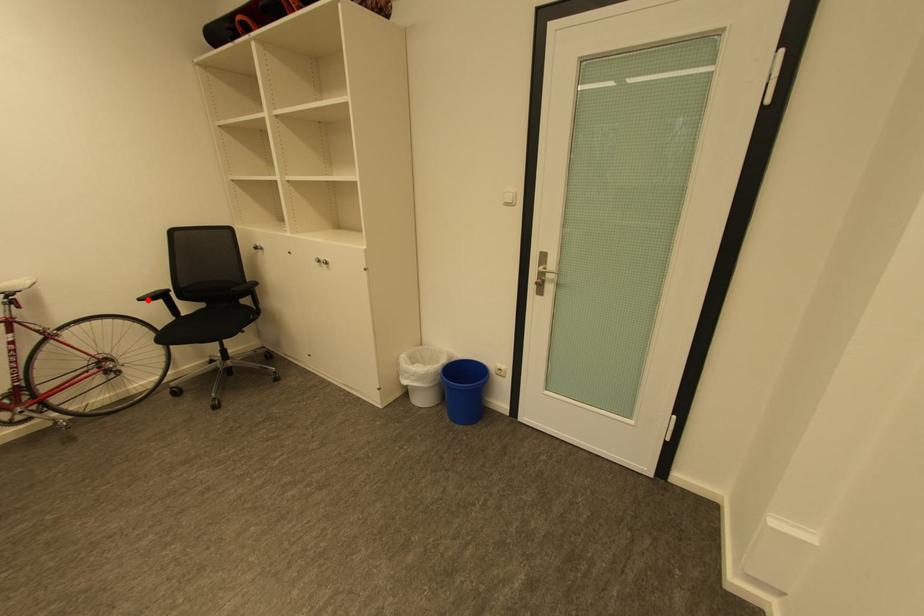
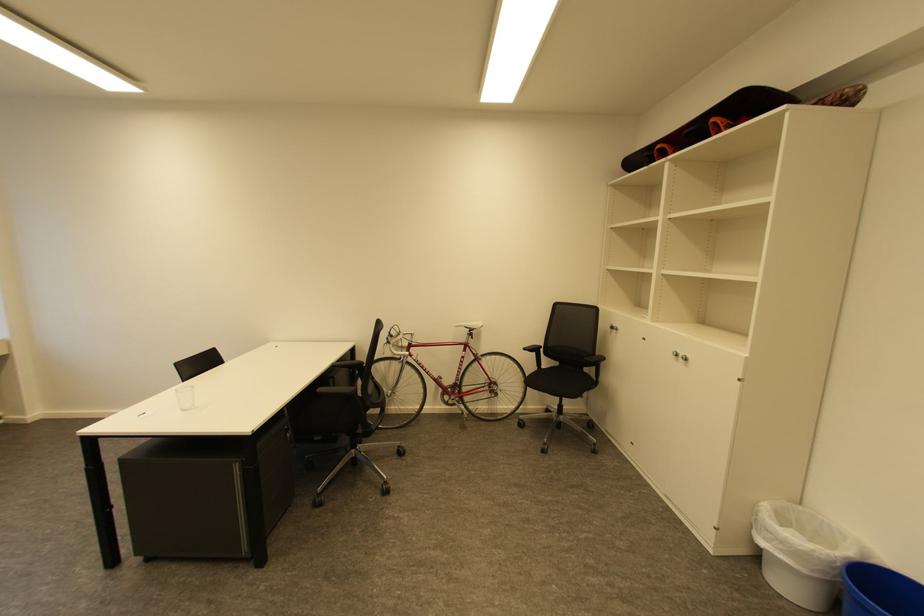
Where in the second image is the point corresponding to the highlighted location from the first image?

(531, 350)